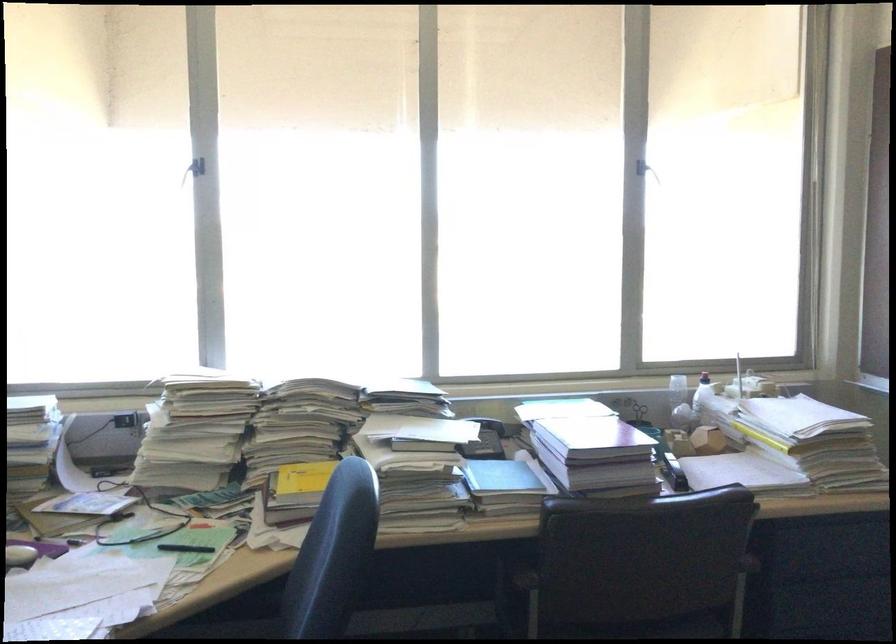
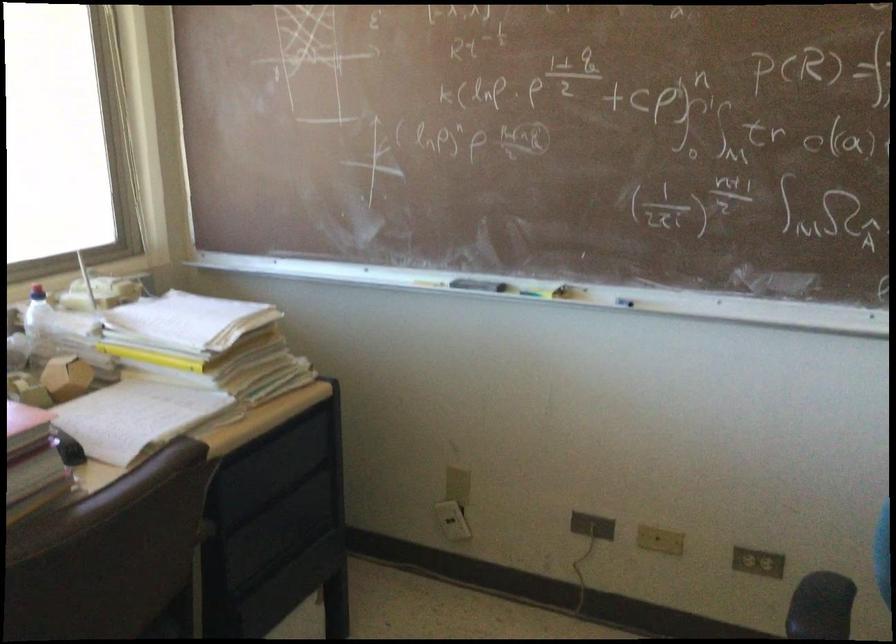
Find the pixel in the second image that matches point 728,379 in the first image.

(37, 292)